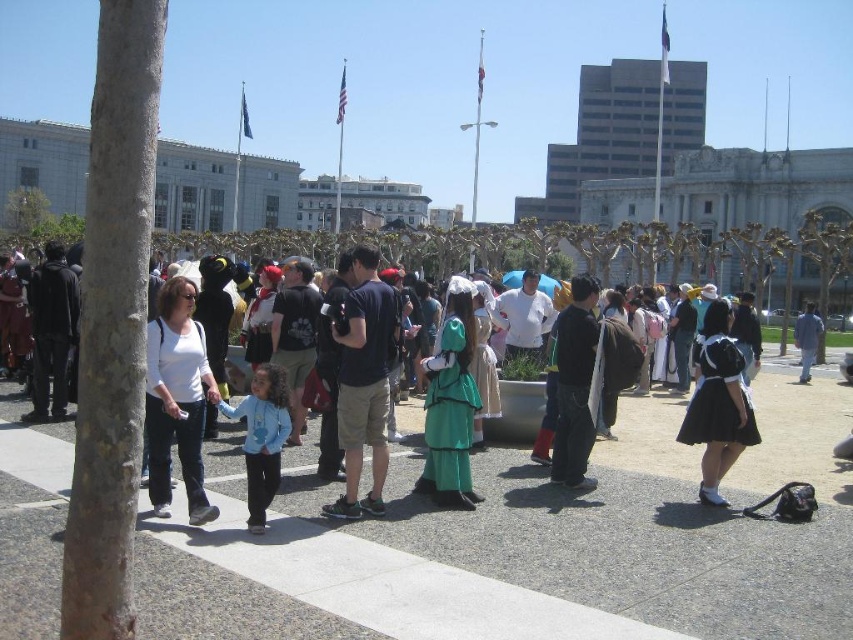
You are standing at the point marked as point [344,394] in the image. The distance from you to the nearest tree trunk on your left is 120.69 feet. Can you see the tree trunk clearly from your current position?

The distance of point [344,394] from viewer is 120.69 feet, so yes, you can see the tree trunk on the left clearly from your current position as it is not too far away.